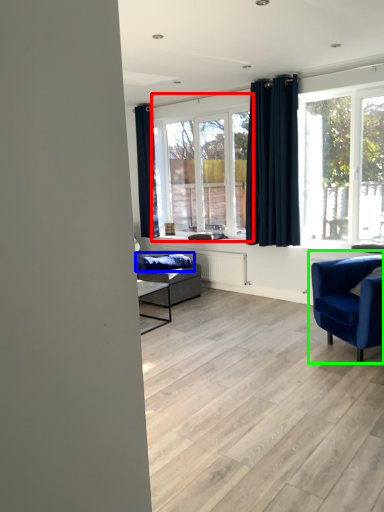
Question: Which object is the closest to the window (highlighted by a red box)? Choose among these: blanket (highlighted by a blue box) or chair (highlighted by a green box).

Choices:
 (A) blanket
 (B) chair

Answer: (A)